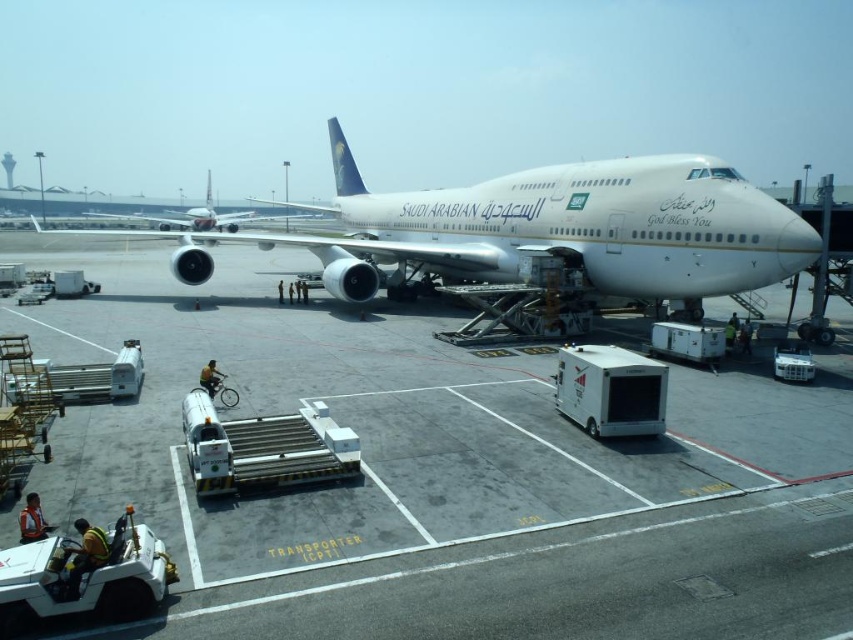
Between white glossy tarmac at center and white metallic airplane at center, which one has less height?

With less height is white glossy tarmac at center.

Can you confirm if white glossy tarmac at center is positioned to the right of white metallic airplane at center?

Indeed, white glossy tarmac at center is positioned on the right side of white metallic airplane at center.

Is point (814, 620) positioned after point (762, 266)?

No, (814, 620) is closer to viewer.

Find the location of a particular element. Image resolution: width=853 pixels, height=640 pixels. white glossy tarmac at center is located at coordinates (445, 476).